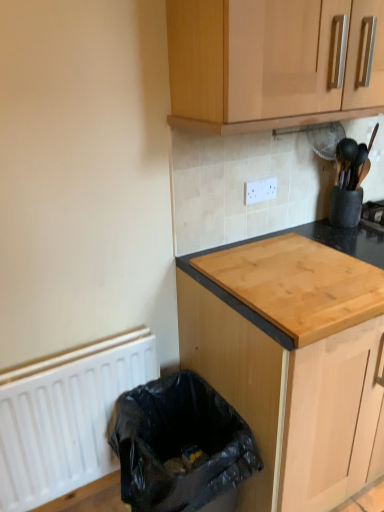
Question: From the image's perspective, is white matte radiator at lower left located above or below black plastic bag at lower left?

Choices:
 (A) below
 (B) above

Answer: (B)

Question: Looking at the image, does white matte radiator at lower left seem bigger or smaller compared to black plastic bag at lower left?

Choices:
 (A) small
 (B) big

Answer: (A)

Question: Which object is positioned closest to the black plastic bag at lower left?

Choices:
 (A) natural wood cutting board at center, which appears as the 2th cabinetry when viewed from the top
 (B) wooden cabinet at upper center, which is the 1th cabinetry in top-to-bottom order
 (C) white matte radiator at lower left
 (D) white plastic electric outlet at upper center
 (E) natural wood countertop at center

Answer: (C)

Question: Based on their relative distances, which object is farther from the black plastic bag at lower left?

Choices:
 (A) white plastic electric outlet at upper center
 (B) natural wood cutting board at center, which is the first cabinetry from bottom to top
 (C) wooden cabinet at upper center, which is the 1th cabinetry in top-to-bottom order
 (D) natural wood countertop at center
 (E) white matte radiator at lower left

Answer: (C)